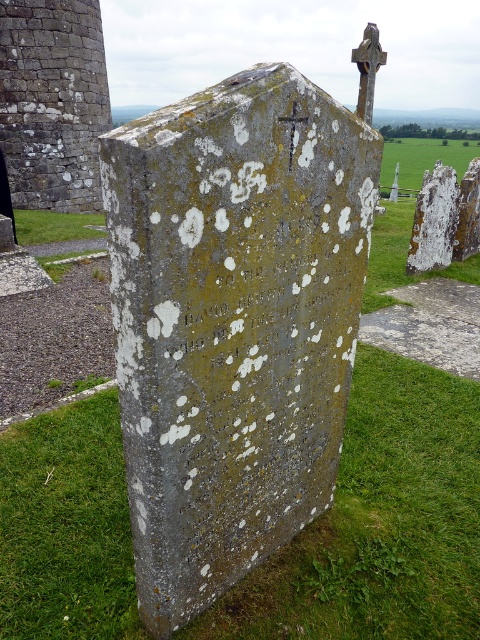
What do you see at coordinates (232, 323) in the screenshot?
I see `speckled stone gravestone at center` at bounding box center [232, 323].

This screenshot has width=480, height=640. I want to click on speckled stone gravestone at center, so click(232, 323).

Measure the distance between point [227,328] and camera.

Point [227,328] and camera are 6.12 feet apart.

Locate an element on the screen. The height and width of the screenshot is (640, 480). speckled stone gravestone at center is located at coordinates (232, 323).